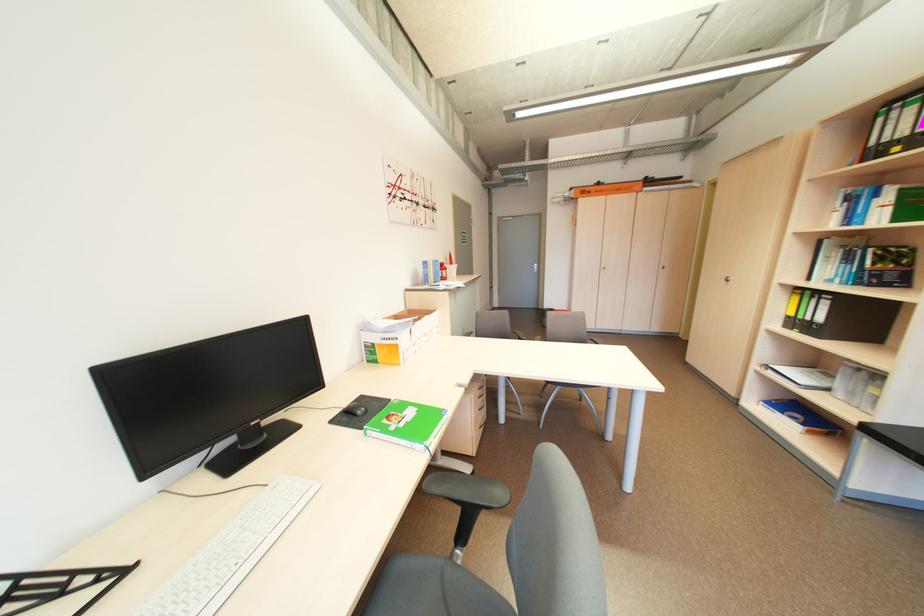
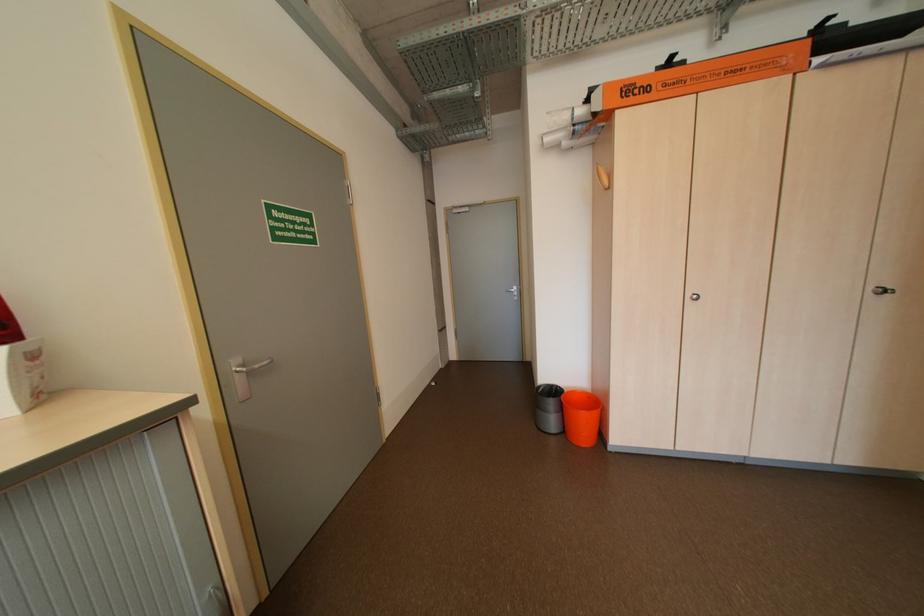
In the second image, find the point that corresponds to pixel 599 193 in the first image.

(655, 90)